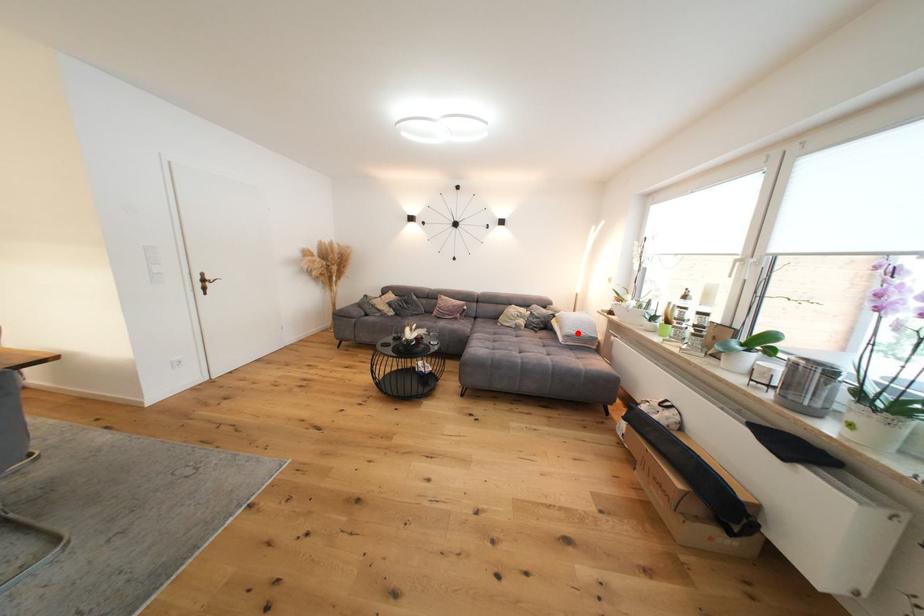
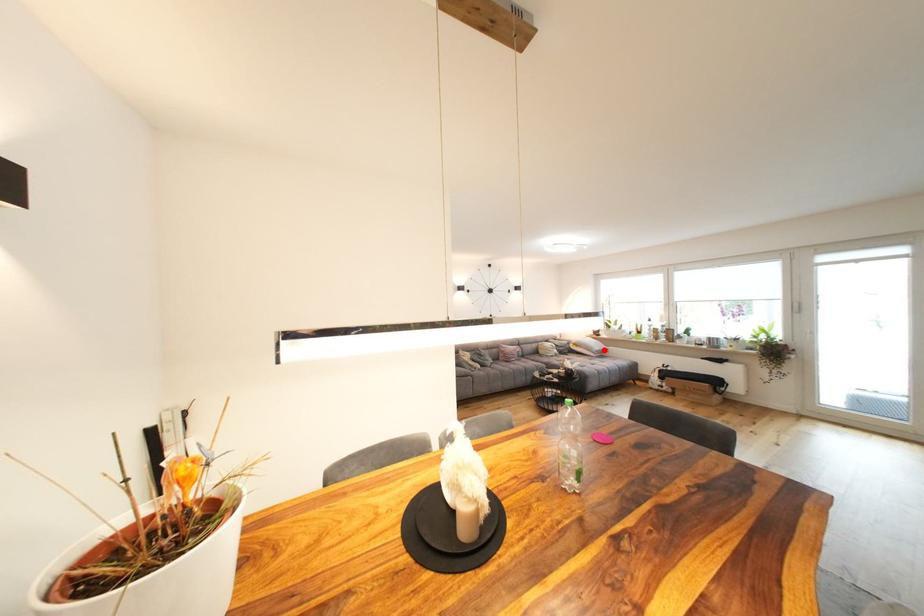
I am providing you with two images of the same scene from different viewpoints. A red point is marked on the first image and another point is marked on the second image. Is the red point in image1 aligned with the point shown in image2?

Yes